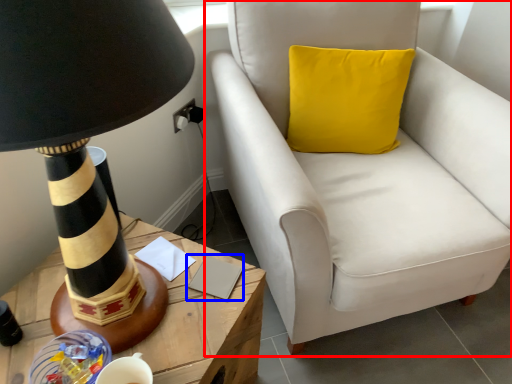
Question: Which object appears farthest to the camera in this image, chair (highlighted by a red box) or notepad (highlighted by a blue box)?

Choices:
 (A) chair
 (B) notepad

Answer: (B)